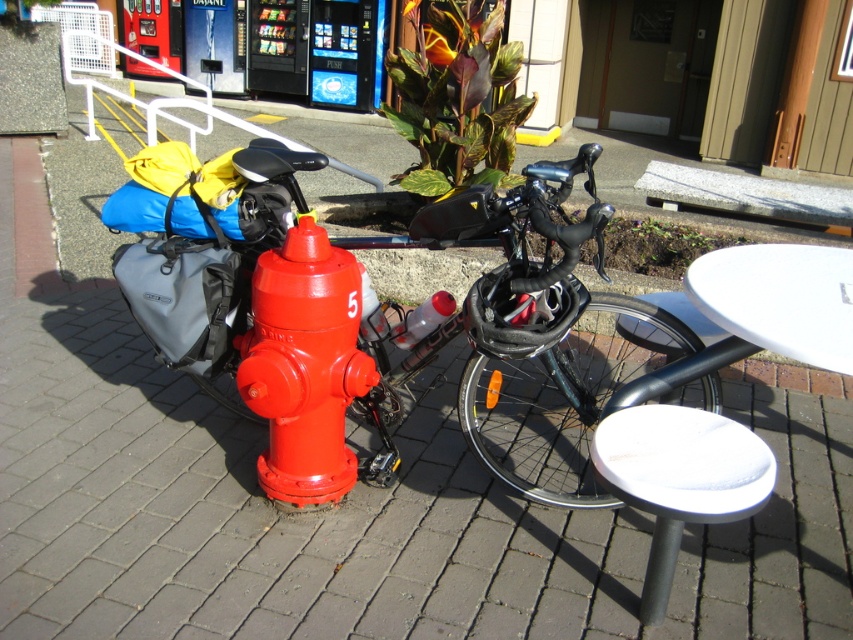
Question: Is glossy red fire hydrant at center above white plastic rail at upper left?

Choices:
 (A) yes
 (B) no

Answer: (B)

Question: Does white glossy table at lower right have a smaller size compared to matte gray bag at center-left?

Choices:
 (A) no
 (B) yes

Answer: (A)

Question: Does white glossy table at lower right lie in front of white plastic table at lower right?

Choices:
 (A) no
 (B) yes

Answer: (A)

Question: Based on their relative distances, which object is farther from the white glossy table at lower right?

Choices:
 (A) glossy red fire hydrant at center
 (B) matte gray bag at center-left

Answer: (B)

Question: Which of these objects is positioned farthest from the shiny black bicycle at center?

Choices:
 (A) glossy red fire hydrant at center
 (B) matte gray bag at center-left
 (C) white glossy table at lower right
 (D) white plastic rail at upper left

Answer: (D)

Question: Which of the following is the farthest from the observer?

Choices:
 (A) white plastic rail at upper left
 (B) glossy red fire hydrant at center
 (C) shiny black bicycle at center

Answer: (A)